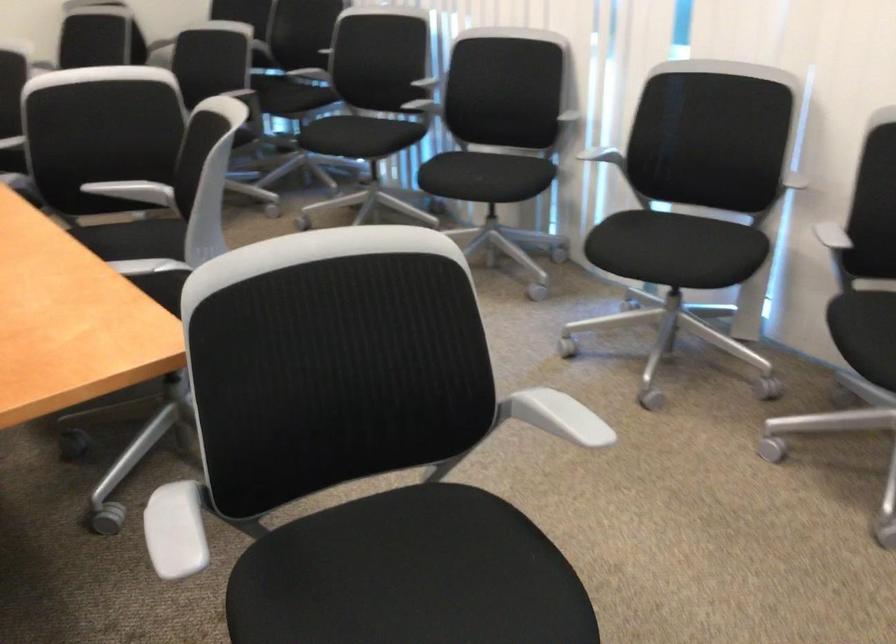
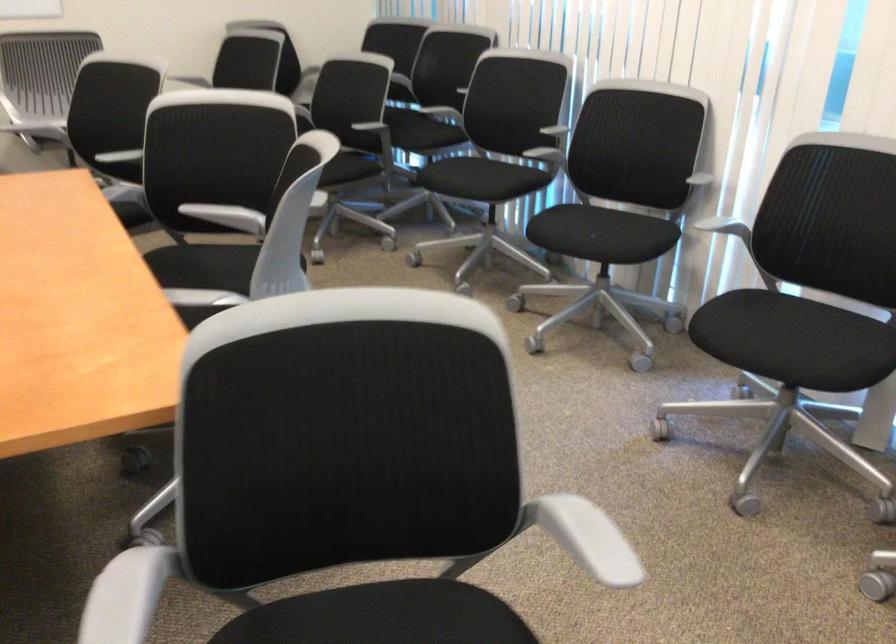
The point at [116,194] is marked in the first image. Where is the corresponding point in the second image?

(208, 212)